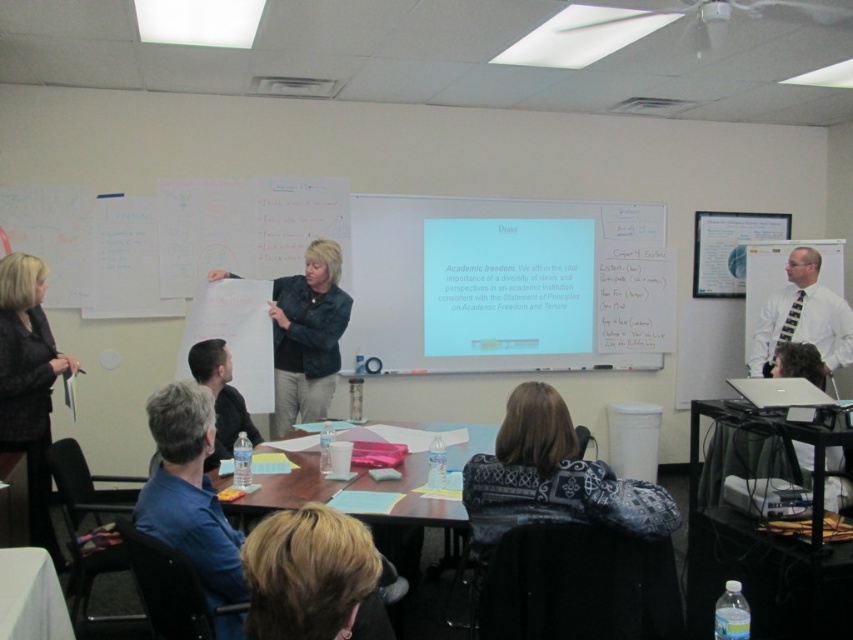
Can you confirm if blonde hair at lower center is positioned below blue fabric shirt at lower left?

Yes, blonde hair at lower center is below blue fabric shirt at lower left.

Find the location of a particular element. The image size is (853, 640). blonde hair at lower center is located at coordinates (312, 577).

Who is positioned more to the left, denim jacket at center or gray fabric shirt at lower left?

gray fabric shirt at lower left is more to the left.

Consider the image. Does denim jacket at center have a larger size compared to gray fabric shirt at lower left?

Yes.

Does point (322, 337) lie in front of point (216, 388)?

That is False.

The height and width of the screenshot is (640, 853). Identify the location of denim jacket at center. (306, 337).

Locate an element on the screen. The height and width of the screenshot is (640, 853). blue fabric shirt at lower left is located at coordinates (190, 499).